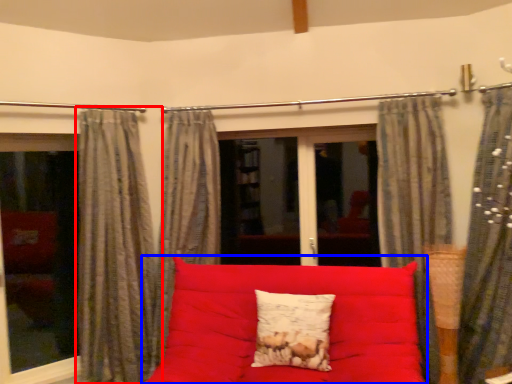
Question: Which object appears closest to the camera in this image, curtain (highlighted by a red box) or studio couch (highlighted by a blue box)?

Choices:
 (A) curtain
 (B) studio couch

Answer: (B)